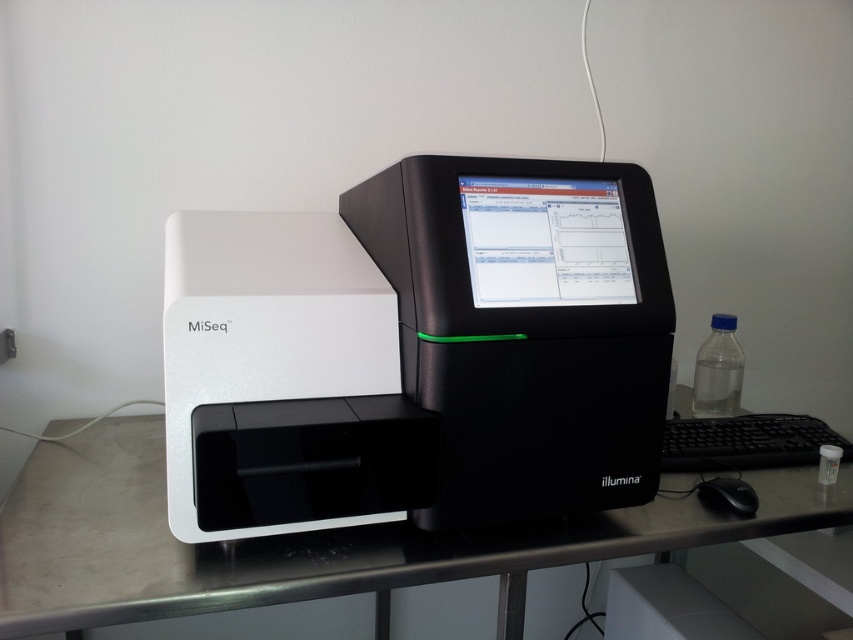
You are setting up a lab workstation and need to place both the white plastic printer at center and the black plastic mouse at lower right on a desk. The desk has a space that can only accommodate items up to 30 cm in width. Based on their widths, can both items fit side by side?

The white plastic printer at center might be wider than black plastic mouse at lower right, but since the exact width difference isn not specified, it is uncertain if their combined width exceeds 30 cm. Further measurement is needed to determine if both can fit side by side.

You are setting up a new lab workstation and need to place both the metallic silver computer desk at center and the matte black monitor at center. Given their sizes, which object should you place first to ensure proper positioning?

The metallic silver computer desk at center has a larger size compared to the matte black monitor at center, so you should place the metallic silver computer desk at center first to accommodate its larger footprint before positioning the matte black monitor at center.